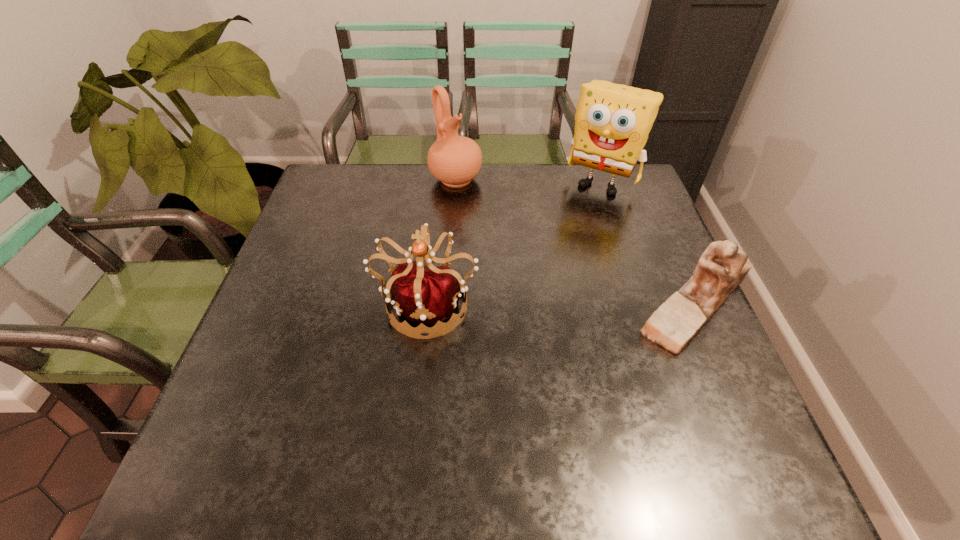
Locate an element on the screen. vacant space at the near edge is located at coordinates (408, 397).

Locate an element on the screen. The height and width of the screenshot is (540, 960). free spot at the left edge of the desktop is located at coordinates (312, 239).

Find the location of a particular element. The image size is (960, 540). vacant area at the right edge of the desktop is located at coordinates [658, 240].

Identify the location of vacant space at the near right corner of the desktop. click(x=670, y=414).

This screenshot has width=960, height=540. I want to click on empty space that is in between the sponge and the third tallest object, so click(x=515, y=242).

You are a GUI agent. You are given a task and a screenshot of the screen. Output one action in this format:
    pyautogui.click(x=<x>, y=<y>)
    Task: Click on the vacant area between the tiara and the sponge
    This screenshot has width=960, height=540.
    Given the screenshot: What is the action you would take?
    pyautogui.click(x=515, y=242)

I want to click on free space between the pottery and the figurine, so click(576, 241).

You are a GUI agent. You are given a task and a screenshot of the screen. Output one action in this format:
    pyautogui.click(x=<x>, y=<y>)
    Task: Click on the blank region between the figurine and the tiara
    
    Given the screenshot: What is the action you would take?
    pos(562,303)

The image size is (960, 540). What are the coordinates of `free space between the tiara and the sponge` in the screenshot? It's located at (515, 242).

Locate an element on the screen. This screenshot has height=540, width=960. vacant region between the figurine and the sponge is located at coordinates (649, 243).